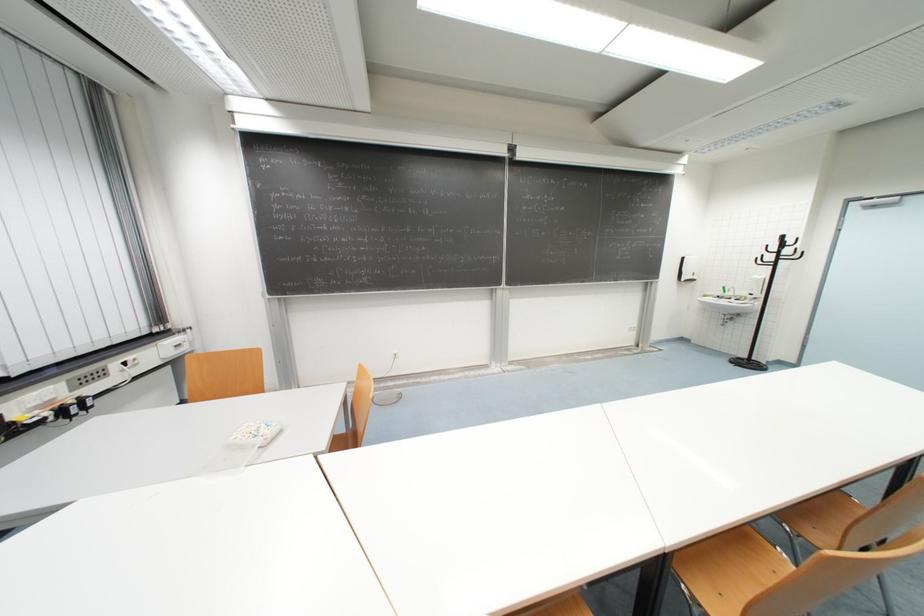
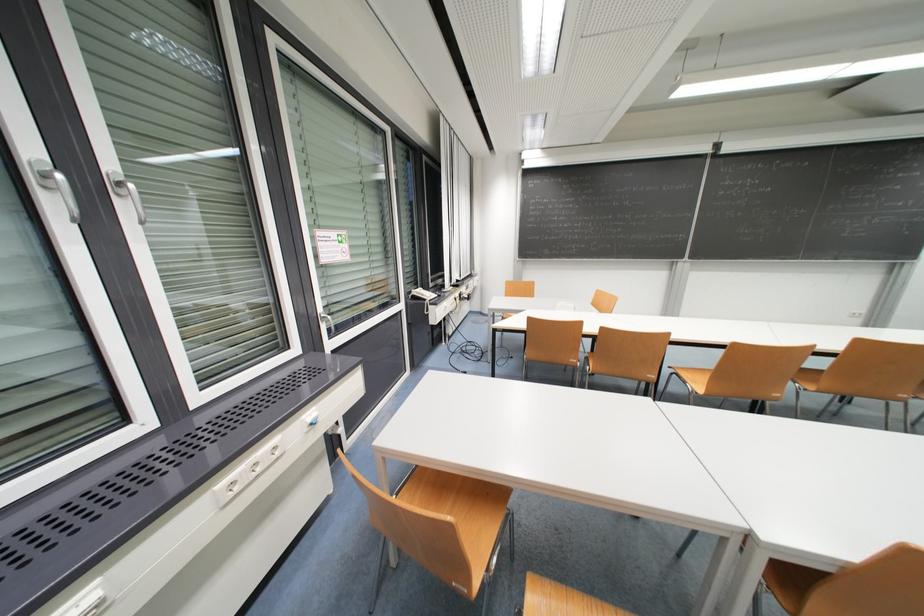
Question: The images are taken continuously from a first-person perspective. In which direction are you moving?

Choices:
 (A) Left
 (B) Right
 (C) Forward
 (D) Backward

Answer: (D)